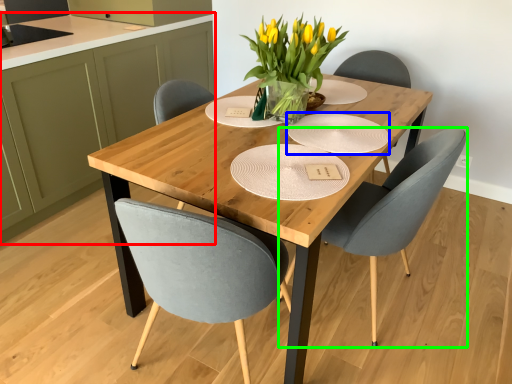
Question: Which object is positioned closest to cabinetry (highlighted by a red box)? Select from paper plate (highlighted by a blue box) and chair (highlighted by a green box).

Choices:
 (A) paper plate
 (B) chair

Answer: (A)